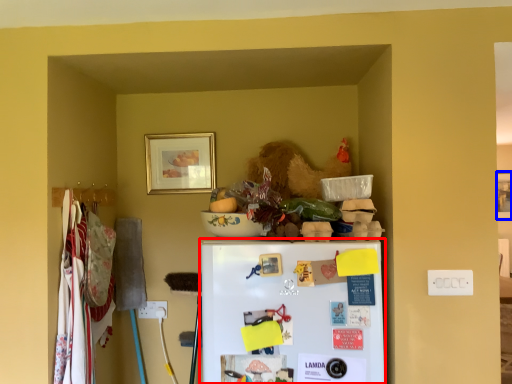
Question: Among these objects, which one is nearest to the camera, refrigerator (highlighted by a red box) or picture frame (highlighted by a blue box)?

Choices:
 (A) refrigerator
 (B) picture frame

Answer: (A)